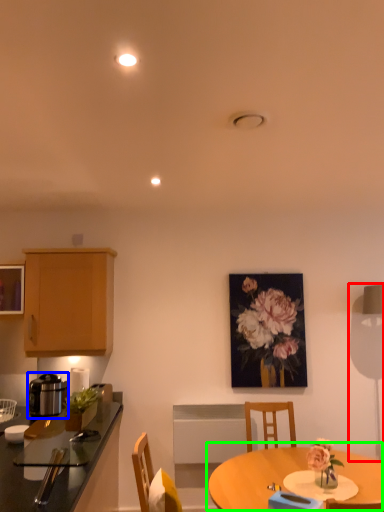
Question: Which object is the farthest from table lamp (highlighted by a red box)? Choose among these: kitchen appliance (highlighted by a blue box) or table (highlighted by a green box).

Choices:
 (A) kitchen appliance
 (B) table

Answer: (A)